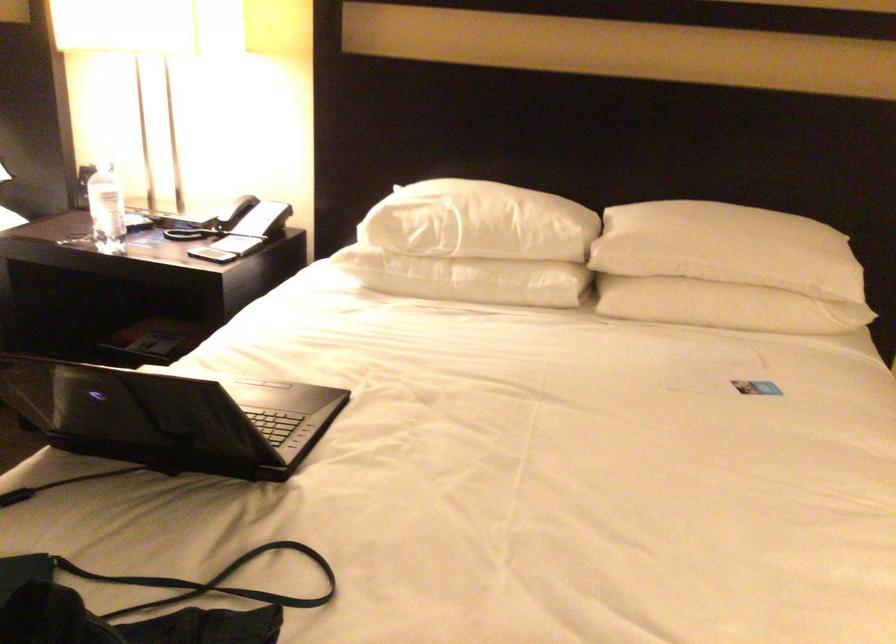
Find where to lift the black smartphone. Please return your answer as a coordinate pair (x, y).

(211, 249)